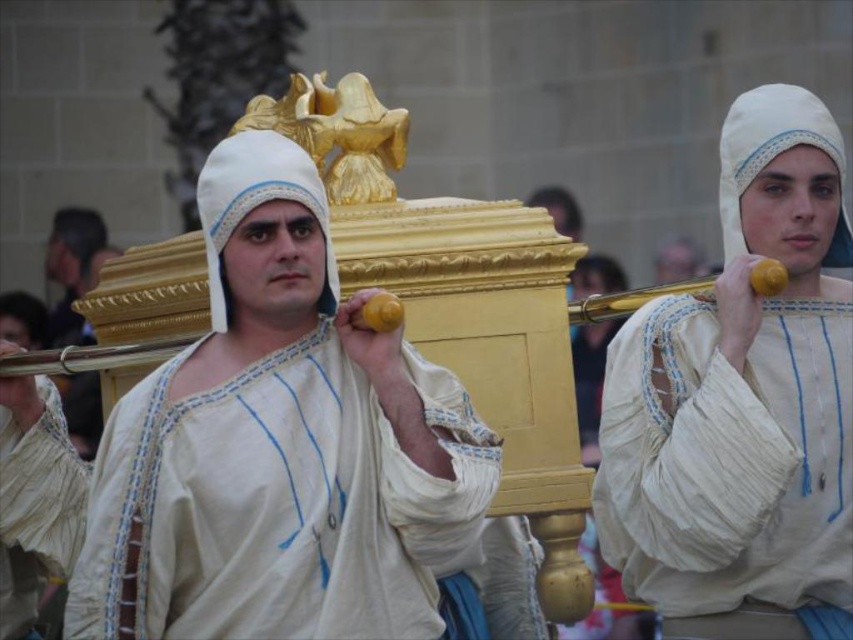
Can you confirm if matte gold casket at center is positioned to the right of matte white robe at center?

Indeed, matte gold casket at center is positioned on the right side of matte white robe at center.

Does matte gold casket at center appear over matte white robe at center?

No, matte gold casket at center is not above matte white robe at center.

What are the coordinates of `matte gold casket at center` in the screenshot? It's located at (280, 448).

Does matte gold casket at center have a greater width compared to white cotton headscarf at upper right?

Yes, matte gold casket at center is wider than white cotton headscarf at upper right.

Does matte gold casket at center have a larger size compared to white cotton headscarf at upper right?

Correct, matte gold casket at center is larger in size than white cotton headscarf at upper right.

Who is more forward, (282, 616) or (817, 168)?

Point (282, 616)

At what (x,y) coordinates should I click in order to perform the action: click on matte gold casket at center. Please return your answer as a coordinate pair (x, y). Looking at the image, I should click on (280, 448).

Between white cotton headscarf at upper right and matte white robe at center, which one appears on the left side from the viewer's perspective?

matte white robe at center

Locate an element on the screen. Image resolution: width=853 pixels, height=640 pixels. white cotton headscarf at upper right is located at coordinates (743, 397).